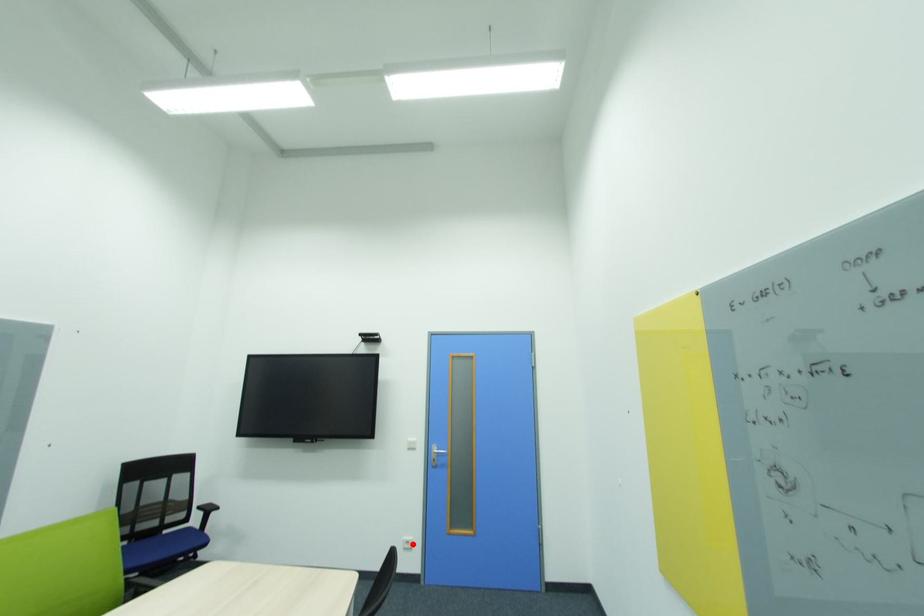
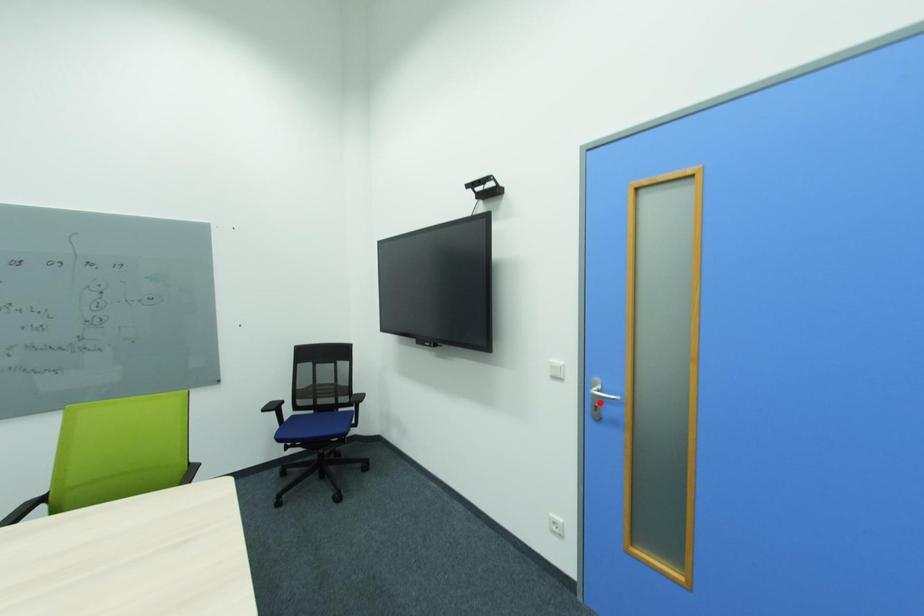
I am providing you with two images of the same scene from different viewpoints. A red point is marked on the first image and another point is marked on the second image. Is the red point in image1 aligned with the point shown in image2?

No